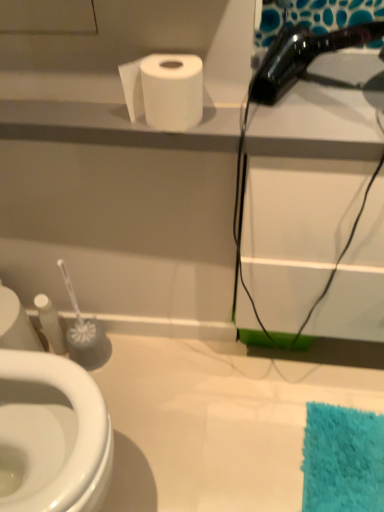
Question: Is shiny black hair dryer at upper right touching white matte toilet paper at upper center?

Choices:
 (A) yes
 (B) no

Answer: (B)

Question: Does shiny black hair dryer at upper right appear on the left side of white matte toilet paper at upper center?

Choices:
 (A) yes
 (B) no

Answer: (B)

Question: Would you say white matte toilet paper at upper center is part of shiny black hair dryer at upper right's contents?

Choices:
 (A) no
 (B) yes

Answer: (A)

Question: From a real-world perspective, is shiny black hair dryer at upper right positioned over white matte toilet paper at upper center based on gravity?

Choices:
 (A) no
 (B) yes

Answer: (B)

Question: Is shiny black hair dryer at upper right positioned beyond the bounds of white matte toilet paper at upper center?

Choices:
 (A) no
 (B) yes

Answer: (B)

Question: Considering the relative positions of shiny black hair dryer at upper right and white matte toilet paper at upper center in the image provided, is shiny black hair dryer at upper right to the right of white matte toilet paper at upper center from the viewer's perspective?

Choices:
 (A) yes
 (B) no

Answer: (A)

Question: Does white matte toilet paper at upper center come in front of shiny black hair dryer at upper right?

Choices:
 (A) no
 (B) yes

Answer: (A)

Question: Can you confirm if white matte toilet paper at upper center is shorter than shiny black hair dryer at upper right?

Choices:
 (A) no
 (B) yes

Answer: (B)

Question: Can you confirm if white matte toilet paper at upper center is positioned to the left of shiny black hair dryer at upper right?

Choices:
 (A) yes
 (B) no

Answer: (A)

Question: Is white matte toilet paper at upper center thinner than shiny black hair dryer at upper right?

Choices:
 (A) yes
 (B) no

Answer: (A)

Question: Is white matte toilet paper at upper center completely or partially outside of shiny black hair dryer at upper right?

Choices:
 (A) yes
 (B) no

Answer: (A)

Question: Does white matte toilet paper at upper center touch shiny black hair dryer at upper right?

Choices:
 (A) no
 (B) yes

Answer: (A)

Question: In terms of height, does white matte toilet paper at upper center look taller or shorter compared to shiny black hair dryer at upper right?

Choices:
 (A) tall
 (B) short

Answer: (B)